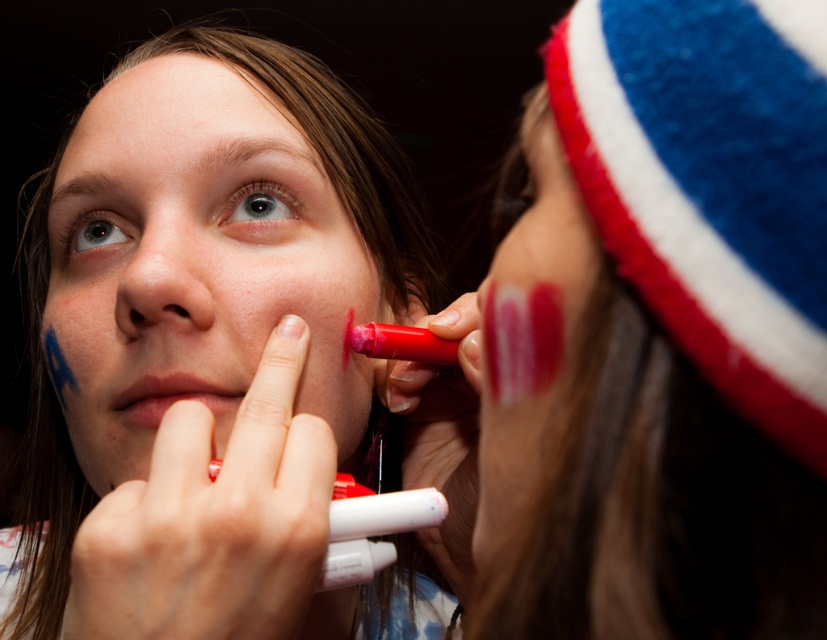
You are a makeup artist trying to apply lipstick. You see the matte pink marker at lower left and the matte pink lips at lower center. Which object should you pick up to apply the lipstick?

You should pick up the matte pink marker at lower left to apply the lipstick because it is positioned to the left of the matte pink lips at lower center, making it accessible for application.

You are a makeup artist trying to apply lipstick precisely. You have a matte pink marker at lower left and need to reach the matte pink lips at lower center. Given that your hand can move 3 inches, will you be able to reach the lips without moving your hand?

The matte pink marker at lower left and matte pink lips at lower center are 2.51 inches apart from each other. Since your hand can move 3 inches, you will be able to reach the matte pink lips at lower center without moving your hand.

You are an artist trying to place a new object between the matte red marker at right and the matte pink paint at right. Can you fit a 1.5 inch wide object between them?

The distance between the matte red marker at right and the matte pink paint at right is 0.54 inches, which is less than the 1.5 inch width of the object. Therefore, you cannot fit the object between them.